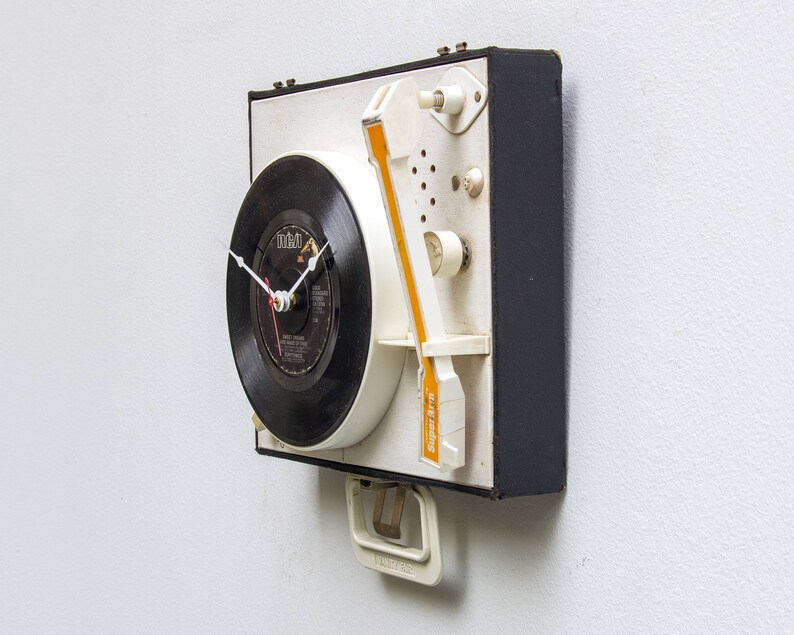
Locate an element on the screen. latch is located at coordinates (394, 522).